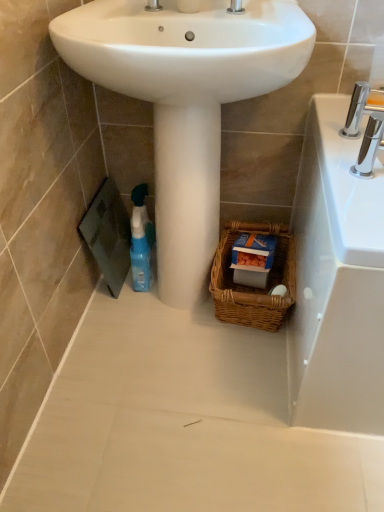
Question: From the image's perspective, does chrome metallic faucet at upper right appear higher than blue plastic spray bottle at lower left?

Choices:
 (A) yes
 (B) no

Answer: (A)

Question: Is chrome metallic faucet at upper right positioned beyond the bounds of blue plastic spray bottle at lower left?

Choices:
 (A) yes
 (B) no

Answer: (A)

Question: Considering the relative sizes of chrome metallic faucet at upper right and blue plastic spray bottle at lower left in the image provided, is chrome metallic faucet at upper right smaller than blue plastic spray bottle at lower left?

Choices:
 (A) yes
 (B) no

Answer: (A)

Question: Is blue plastic spray bottle at lower left inside chrome metallic faucet at upper right?

Choices:
 (A) no
 (B) yes

Answer: (A)

Question: Considering the relative positions of chrome metallic faucet at upper right and blue plastic spray bottle at lower left in the image provided, is chrome metallic faucet at upper right to the left of blue plastic spray bottle at lower left from the viewer's perspective?

Choices:
 (A) no
 (B) yes

Answer: (A)

Question: From a real-world perspective, is chrome metallic faucet at upper right physically below blue plastic spray bottle at lower left?

Choices:
 (A) yes
 (B) no

Answer: (B)

Question: Is blue plastic spray bottle at lower left bigger than woven brown basket at lower center?

Choices:
 (A) no
 (B) yes

Answer: (A)

Question: Is the surface of blue plastic spray bottle at lower left in direct contact with woven brown basket at lower center?

Choices:
 (A) yes
 (B) no

Answer: (B)

Question: Is blue plastic spray bottle at lower left oriented away from woven brown basket at lower center?

Choices:
 (A) yes
 (B) no

Answer: (B)

Question: From a real-world perspective, is blue plastic spray bottle at lower left on woven brown basket at lower center?

Choices:
 (A) yes
 (B) no

Answer: (A)

Question: From the image's perspective, would you say blue plastic spray bottle at lower left is positioned over woven brown basket at lower center?

Choices:
 (A) yes
 (B) no

Answer: (A)

Question: Does blue plastic spray bottle at lower left have a greater height compared to woven brown basket at lower center?

Choices:
 (A) no
 (B) yes

Answer: (B)

Question: Is woven brown basket at lower center at the right side of white glossy sink at center?

Choices:
 (A) yes
 (B) no

Answer: (A)